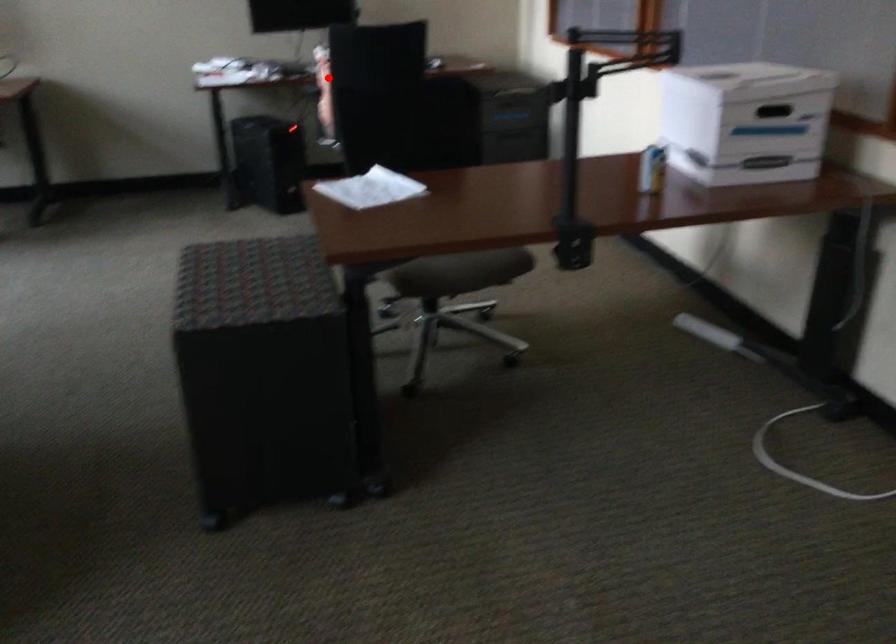
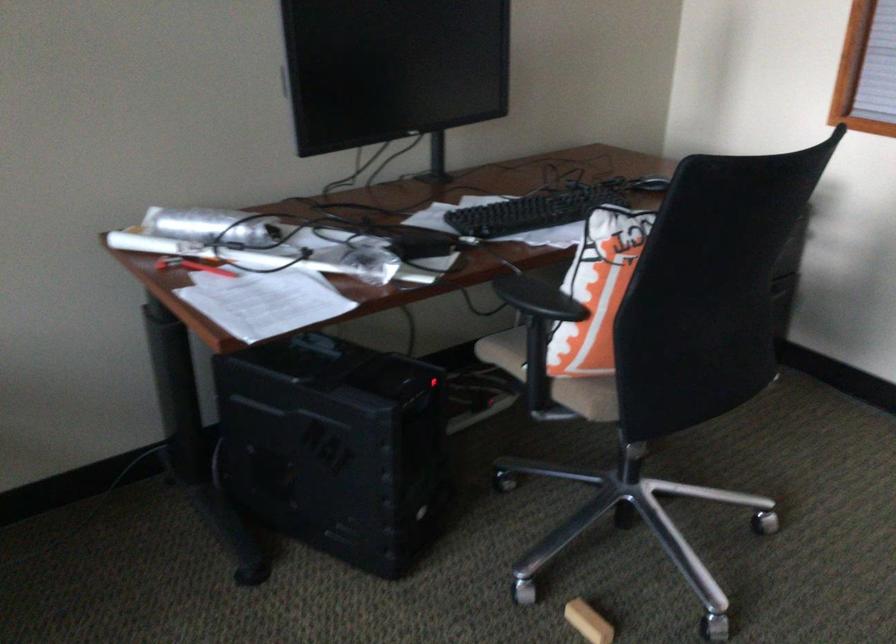
Question: A red point is marked in image1. In image2, is the corresponding 3D point closer to the camera or farther? Reply with the corresponding letter.

Choices:
 (A) The corresponding 3D point is closer.
 (B) The corresponding 3D point is farther.

Answer: (A)